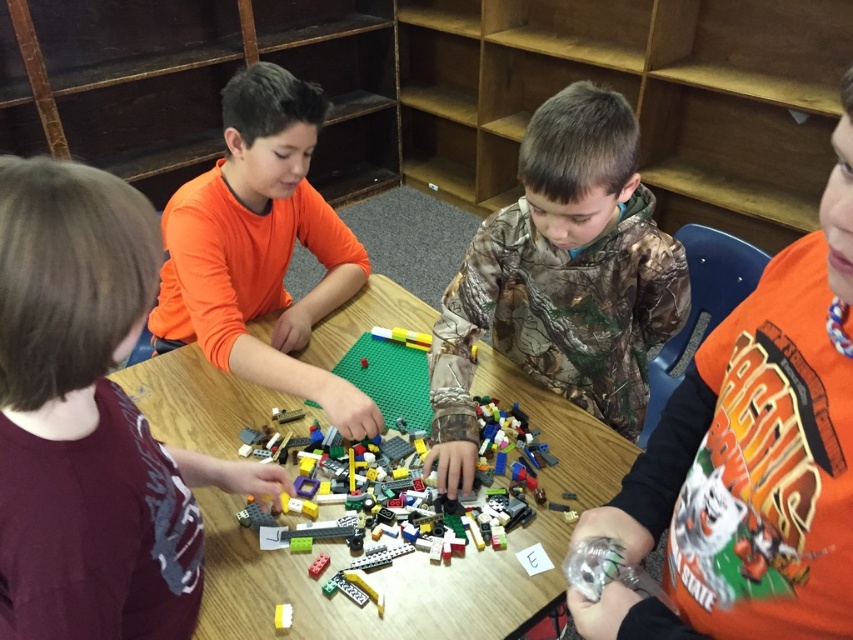
Question: Can you confirm if orange cotton shirt at right is bigger than white plastic block at center?

Choices:
 (A) yes
 (B) no

Answer: (A)

Question: Can you confirm if orange cotton shirt at right is positioned to the left of rubberized red brick at center?

Choices:
 (A) no
 (B) yes

Answer: (A)

Question: Which of these objects is positioned farthest from the multicolored plastic lego pieces at center?

Choices:
 (A) translucent yellow plastic blocks at center
 (B) wooden bookshelf at upper center

Answer: (B)

Question: Which is farther from the multicolored plastic lego pieces at center?

Choices:
 (A) orange cotton shirt at right
 (B) white plastic block at center

Answer: (A)

Question: From the image, what is the correct spatial relationship of wooden bookshelf at upper center in relation to multicolored plastic lego pieces at center?

Choices:
 (A) above
 (B) below

Answer: (A)

Question: Among these points, which one is nearest to the camera?

Choices:
 (A) (694, 496)
 (B) (165, 273)

Answer: (A)